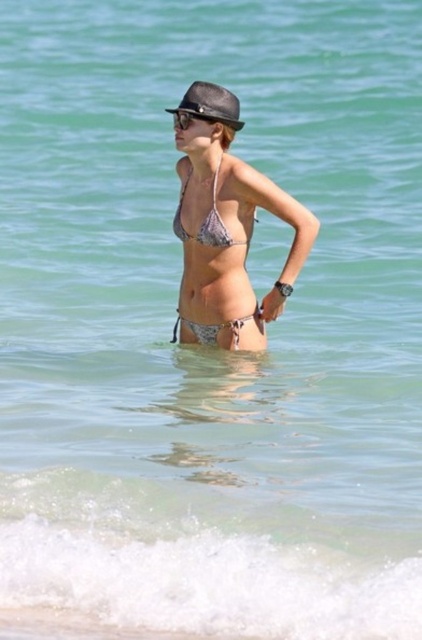
Question: Among these points, which one is farthest from the camera?

Choices:
 (A) (181, 113)
 (B) (207, 227)
 (C) (237, 244)

Answer: (A)

Question: Which object appears farthest from the camera in this image?

Choices:
 (A) black matte goggles at upper center
 (B) metallic bikini at center

Answer: (A)

Question: Which of the following is the farthest from the observer?

Choices:
 (A) silver metallic bikini top at center
 (B) shiny black baseball hat at center
 (C) metallic bikini at center
 (D) purple floral bikini at center

Answer: (D)

Question: Is purple floral bikini at center closer to camera compared to shiny black baseball hat at center?

Choices:
 (A) yes
 (B) no

Answer: (B)

Question: Does metallic bikini at center appear on the left side of silver metallic bikini top at center?

Choices:
 (A) no
 (B) yes

Answer: (A)

Question: Is shiny black baseball hat at center to the right of black matte goggles at upper center from the viewer's perspective?

Choices:
 (A) no
 (B) yes

Answer: (B)